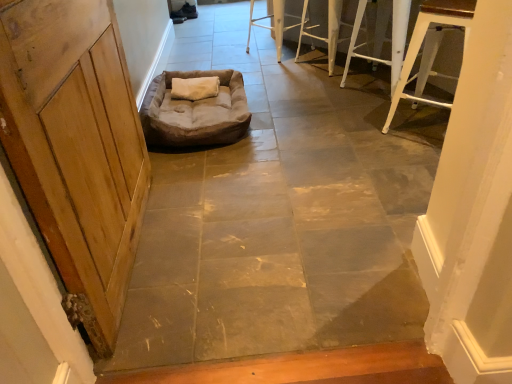
Question: From the image's perspective, is brown fabric dog bed at center above or below white metal stool at upper right, acting as the fourth furniture starting from the back?

Choices:
 (A) below
 (B) above

Answer: (A)

Question: Is brown fabric dog bed at center to the left or to the right of white metal stool at upper right, which is counted as the 1th furniture, starting from the front, in the image?

Choices:
 (A) left
 (B) right

Answer: (A)

Question: Which object is the closest to the wooden door at left?

Choices:
 (A) white metal stool at upper right, which is counted as the 1th furniture, starting from the front
 (B) white metal stool at upper right, the third furniture from the back
 (C) white metal stool at upper center, marked as the 4th furniture in a front-to-back arrangement
 (D) brown fabric dog bed at center
 (E) white metal stool at upper right, the third furniture viewed from the front

Answer: (D)

Question: Based on their relative distances, which object is nearer to the white metal stool at upper right, the third furniture from the back?

Choices:
 (A) wooden door at left
 (B) brown suede dog bed at center
 (C) brown fabric dog bed at center
 (D) white metal stool at upper right, acting as the fourth furniture starting from the back
 (E) white metal stool at upper right, which is counted as the 2th furniture, starting from the back

Answer: (D)